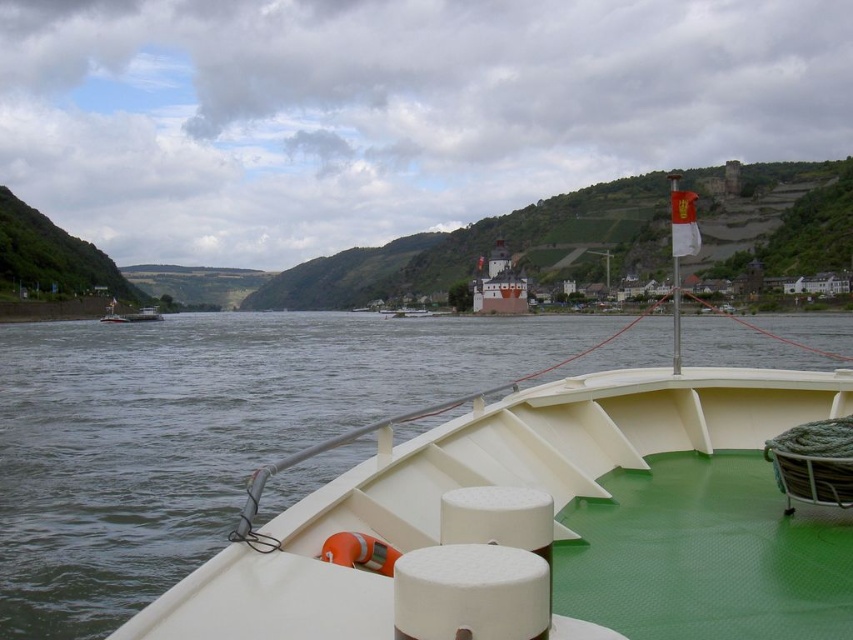
You are a tourist on a boat deck and want to take a photo of both the green rubber water at center and the white matte castle at center. Which object should you adjust your camera to focus on first if you want to ensure both are in the frame?

The green rubber water at center is wider than the white matte castle at center, so you should focus on the green rubber water at center first to ensure both fit in the frame.

You are standing on the deck of the boat and see the green rubber water at center and the white matte castle at center. Which object is positioned lower from your viewpoint?

The green rubber water at center is located below the white matte castle at center, so it is positioned lower from your viewpoint.

You are an architect designing a new observation deck on the boat. You need to ensure that the green rubber water at center and the white matte castle at center are visible from the deck. Considering their heights, which object will require a taller platform to see over the other?

The white matte castle at center requires a taller platform because the green rubber water at center has a lesser height compared to it, so to see over the green rubber water at center, the platform must be higher than its height.